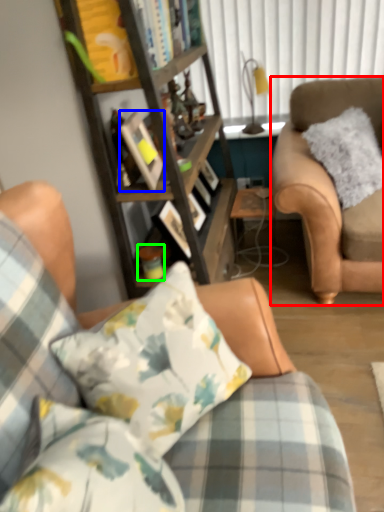
Question: Which object is the closest to the chair (highlighted by a red box)? Choose among these: picture frame (highlighted by a blue box) or coffee cup (highlighted by a green box).

Choices:
 (A) picture frame
 (B) coffee cup

Answer: (A)